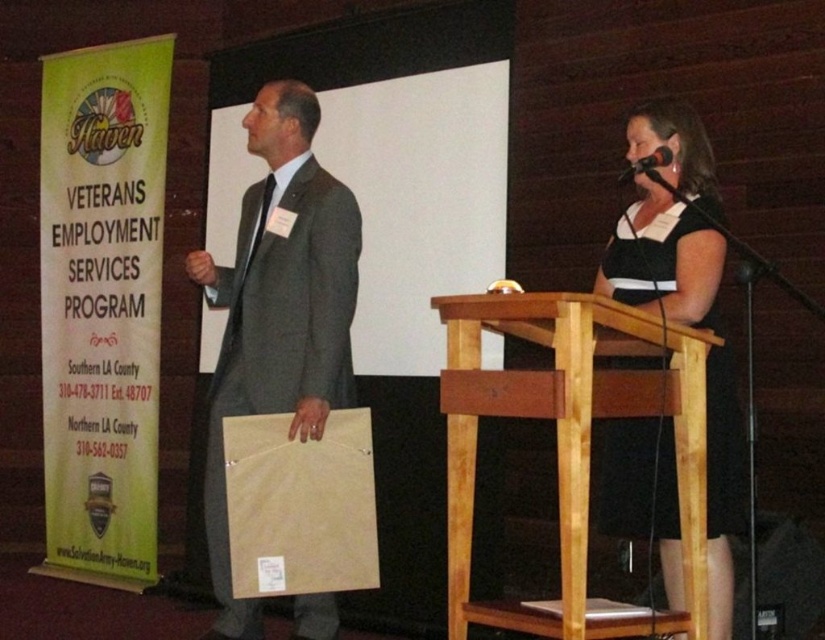
Question: Does matte gray suit at center lie in front of black satin dress at center?

Choices:
 (A) no
 (B) yes

Answer: (A)

Question: Among these points, which one is farthest from the camera?

Choices:
 (A) (291, 131)
 (B) (666, 154)
 (C) (479, 310)

Answer: (A)

Question: Is light brown wood podium at center positioned at the back of black plastic microphone at upper right?

Choices:
 (A) no
 (B) yes

Answer: (A)

Question: Is light brown wood podium at center bigger than black satin dress at center?

Choices:
 (A) no
 (B) yes

Answer: (A)

Question: Which object appears farthest from the camera in this image?

Choices:
 (A) light brown wood podium at center
 (B) black satin dress at center
 (C) matte gray suit at center

Answer: (C)

Question: Which of the following is the farthest from the observer?

Choices:
 (A) black satin dress at center
 (B) light brown wood podium at center
 (C) matte gray suit at center
 (D) black plastic microphone at upper right

Answer: (C)